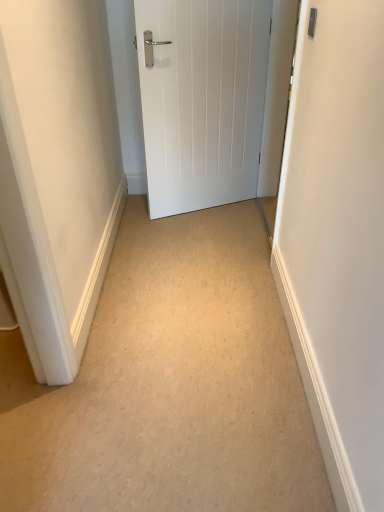
Describe the element at coordinates (202, 99) in the screenshot. The height and width of the screenshot is (512, 384). I see `white matte door at center` at that location.

The height and width of the screenshot is (512, 384). Identify the location of white matte door at center. (202, 99).

Measure the distance between white matte door at center and camera.

white matte door at center and camera are 6.65 feet apart.

Measure the distance between point (198,106) and camera.

7.90 feet.

Describe the element at coordinates (169, 384) in the screenshot. I see `beige carpet at center` at that location.

Where is `beige carpet at center`? Image resolution: width=384 pixels, height=512 pixels. beige carpet at center is located at coordinates (169, 384).

Where is `white matte door at center`? This screenshot has height=512, width=384. white matte door at center is located at coordinates (202, 99).

Considering the positions of objects white matte door at center and beige carpet at center in the image provided, who is more to the left, white matte door at center or beige carpet at center?

Positioned to the left is beige carpet at center.

Considering their positions, is white matte door at center located in front of or behind beige carpet at center?

In the image, white matte door at center appears behind beige carpet at center.

Does point (206, 160) come in front of point (163, 466)?

No, it is behind (163, 466).

From the image's perspective, is white matte door at center under beige carpet at center?

No.

From a real-world perspective, between white matte door at center and beige carpet at center, who is vertically higher?

white matte door at center, from a real-world perspective.

Looking at this image, looking at their sizes, would you say white matte door at center is wider or thinner than beige carpet at center?

Considering their sizes, white matte door at center looks slimmer than beige carpet at center.

Can you confirm if white matte door at center is shorter than beige carpet at center?

In fact, white matte door at center may be taller than beige carpet at center.

Can you confirm if white matte door at center is smaller than beige carpet at center?

Incorrect, white matte door at center is not smaller in size than beige carpet at center.

Would you say white matte door at center contains beige carpet at center?

Actually, beige carpet at center is outside white matte door at center.

Is white matte door at center next to beige carpet at center?

No.

Is white matte door at center oriented towards beige carpet at center?

No, white matte door at center is not turned towards beige carpet at center.

Where is `door behind the beige carpet at center`? Image resolution: width=384 pixels, height=512 pixels. door behind the beige carpet at center is located at coordinates (202, 99).

Considering the relative positions of beige carpet at center and white matte door at center in the image provided, is beige carpet at center to the right of white matte door at center from the viewer's perspective?

No.

Is beige carpet at center in front of or behind white matte door at center in the image?

beige carpet at center is positioned closer to the viewer than white matte door at center.

Is point (189, 496) in front of point (254, 166)?

Yes, it is.

From the image's perspective, relative to white matte door at center, is beige carpet at center above or below?

Clearly, from the image's perspective, beige carpet at center is below white matte door at center.

In the scene shown: From a real-world perspective, is beige carpet at center positioned above or below white matte door at center?

From a real-world perspective, beige carpet at center is physically below white matte door at center.

Which of these two, beige carpet at center or white matte door at center, is thinner?

white matte door at center.

Does beige carpet at center have a lesser height compared to white matte door at center?

Correct, beige carpet at center is not as tall as white matte door at center.

Looking at the image, does beige carpet at center seem bigger or smaller compared to white matte door at center?

beige carpet at center is smaller than white matte door at center.

Is beige carpet at center spatially inside white matte door at center, or outside of it?

The correct answer is: outside.

Based on the photo, are beige carpet at center and white matte door at center beside each other?

beige carpet at center and white matte door at center are clearly separated.

Is beige carpet at center oriented towards white matte door at center?

No, beige carpet at center is not turned towards white matte door at center.

Locate an element on the screen. The width and height of the screenshot is (384, 512). door on the right of beige carpet at center is located at coordinates (202, 99).

Where is `path in front of the white matte door at center`? The height and width of the screenshot is (512, 384). path in front of the white matte door at center is located at coordinates (169, 384).

I want to click on door located behind the beige carpet at center, so click(x=202, y=99).